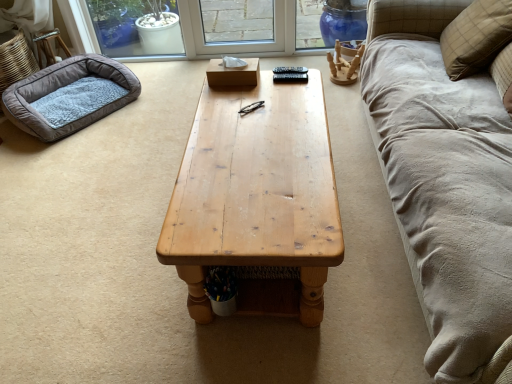
Question: Considering the relative sizes of beige plaid pillow at upper right and natural wood coffee table at center in the image provided, is beige plaid pillow at upper right taller than natural wood coffee table at center?

Choices:
 (A) no
 (B) yes

Answer: (B)

Question: Is beige plaid pillow at upper right behind natural wood coffee table at center?

Choices:
 (A) yes
 (B) no

Answer: (A)

Question: Considering the relative sizes of beige plaid pillow at upper right and natural wood coffee table at center in the image provided, is beige plaid pillow at upper right shorter than natural wood coffee table at center?

Choices:
 (A) yes
 (B) no

Answer: (B)

Question: Is beige plaid pillow at upper right touching natural wood coffee table at center?

Choices:
 (A) no
 (B) yes

Answer: (A)

Question: From a real-world perspective, is beige plaid pillow at upper right over natural wood coffee table at center?

Choices:
 (A) no
 (B) yes

Answer: (B)

Question: From the image's perspective, is beige plaid pillow at upper right over natural wood coffee table at center?

Choices:
 (A) yes
 (B) no

Answer: (A)

Question: From a real-world perspective, does soft gray fleece dog bed at left sit lower than natural wood coffee table at center?

Choices:
 (A) yes
 (B) no

Answer: (A)

Question: Is natural wood coffee table at center surrounded by soft gray fleece dog bed at left?

Choices:
 (A) yes
 (B) no

Answer: (B)

Question: From a real-world perspective, is soft gray fleece dog bed at left located higher than natural wood coffee table at center?

Choices:
 (A) yes
 (B) no

Answer: (B)

Question: Is soft gray fleece dog bed at left bigger than natural wood coffee table at center?

Choices:
 (A) no
 (B) yes

Answer: (A)

Question: From the image's perspective, is soft gray fleece dog bed at left located above natural wood coffee table at center?

Choices:
 (A) yes
 (B) no

Answer: (A)

Question: Is soft gray fleece dog bed at left not within natural wood coffee table at center?

Choices:
 (A) no
 (B) yes

Answer: (B)

Question: Does beige plaid pillow at upper right appear on the right side of soft gray fleece dog bed at left?

Choices:
 (A) yes
 (B) no

Answer: (A)